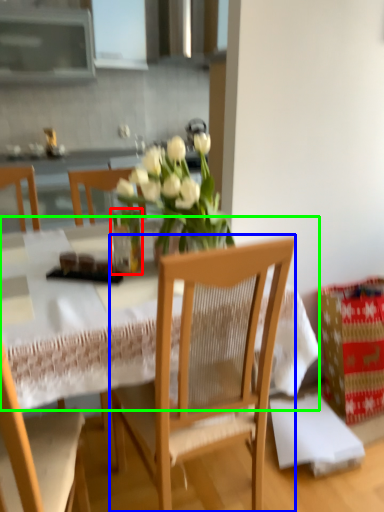
Question: Based on their relative distances, which object is nearer to glass vase (highlighted by a red box)? Choose from chair (highlighted by a blue box) and round table (highlighted by a green box).

Choices:
 (A) chair
 (B) round table

Answer: (B)